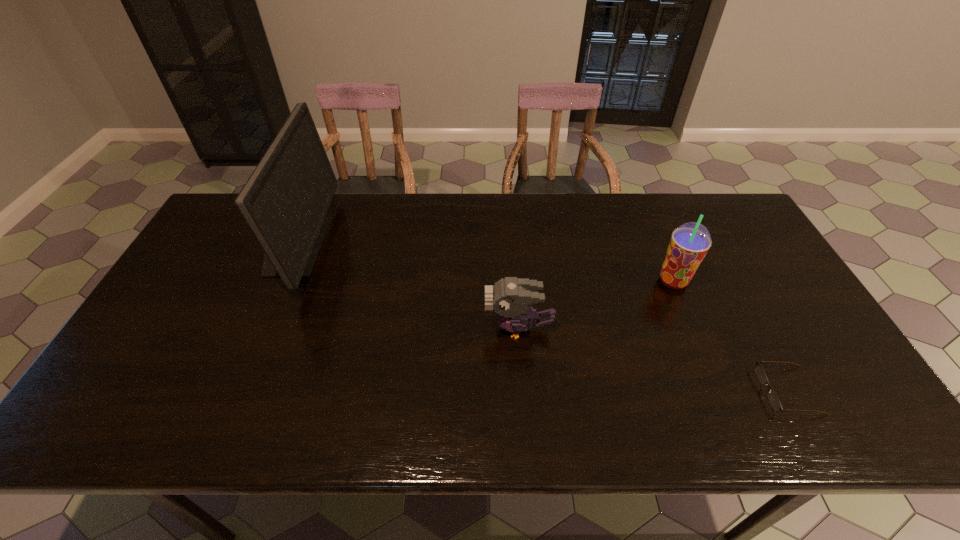
Image resolution: width=960 pixels, height=540 pixels. Identify the location of computer monitor. (285, 201).

The image size is (960, 540). Find the location of `the tallest object`. the tallest object is located at coordinates (285, 201).

Find the location of a particular element. This screenshot has width=960, height=540. the third shortest object is located at coordinates (690, 242).

I want to click on the third object from left to right, so click(x=690, y=242).

Locate an element on the screen. the second nearest object is located at coordinates (509, 297).

Find the location of a particular element. This screenshot has height=540, width=960. bird is located at coordinates (509, 297).

The image size is (960, 540). Find the location of `the nearest object`. the nearest object is located at coordinates (759, 371).

Find the location of `the rightmost object`. the rightmost object is located at coordinates (759, 371).

I want to click on free location located on the screen side of the tallest object, so click(x=445, y=243).

Find the location of a particular element. The height and width of the screenshot is (540, 960). vacant region located 0.060m on the right of the second object from right to left is located at coordinates (711, 281).